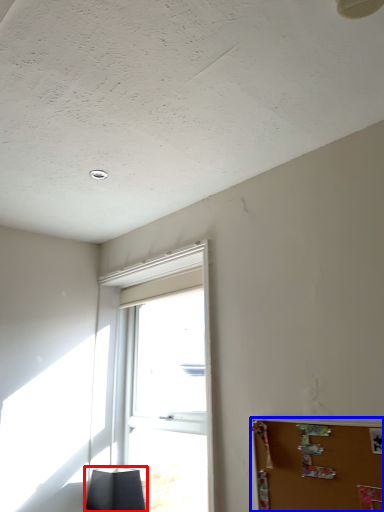
Question: Which point is further to the camera, lamp (highlighted by a red box) or bulletin board (highlighted by a blue box)?

Choices:
 (A) lamp
 (B) bulletin board

Answer: (A)